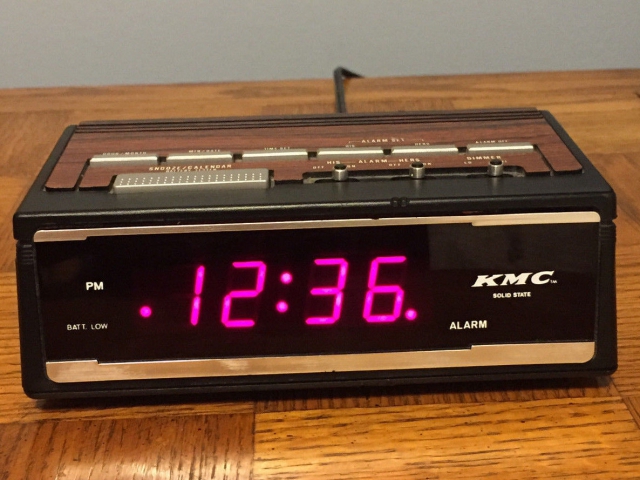
In order to click on brown table in this screenshot , I will do `click(239, 103)`.